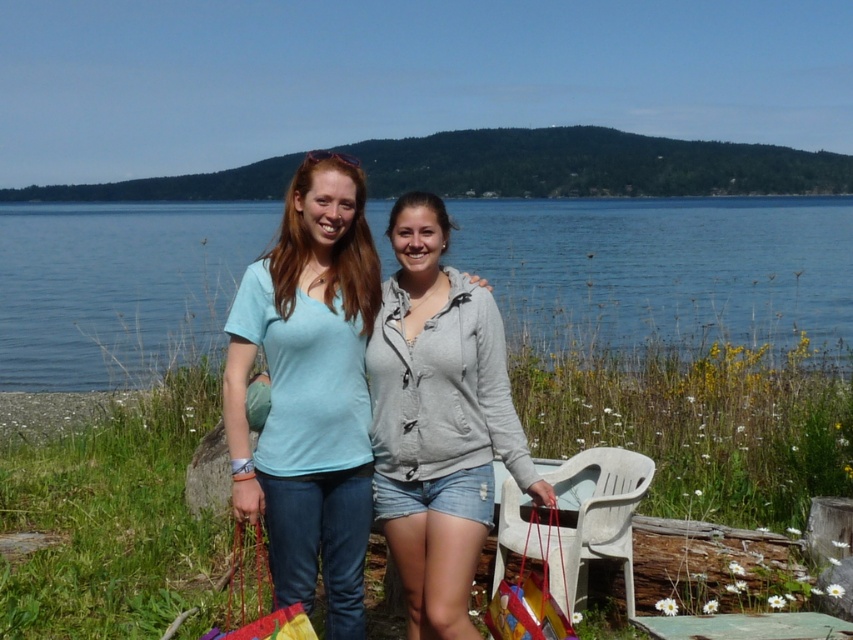
Does blue water at center have a greater height compared to light blue cotton t-shirt at center?

Yes, blue water at center is taller than light blue cotton t-shirt at center.

Who is taller, blue water at center or light blue cotton t-shirt at center?

blue water at center

The image size is (853, 640). What do you see at coordinates (663, 266) in the screenshot?
I see `blue water at center` at bounding box center [663, 266].

Locate an element on the screen. The image size is (853, 640). blue water at center is located at coordinates (663, 266).

Can you confirm if green grass at lower center is thinner than gray matte hoodie at center?

No.

Does green grass at lower center have a smaller size compared to gray matte hoodie at center?

No.

Where is `green grass at lower center`? The height and width of the screenshot is (640, 853). green grass at lower center is located at coordinates (701, 426).

Identify the location of green grass at lower center. click(701, 426).

Is green grass at lower center further to camera compared to light blue cotton t-shirt at center?

Yes, green grass at lower center is further from the viewer.

Can you confirm if green grass at lower center is wider than light blue cotton t-shirt at center?

Yes.

This screenshot has height=640, width=853. Identify the location of green grass at lower center. (701, 426).

Locate an element on the screen. green grass at lower center is located at coordinates (701, 426).